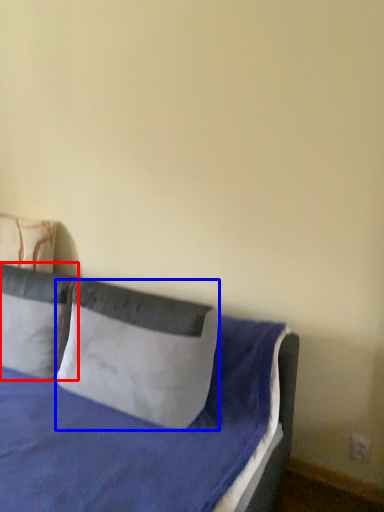
Question: Which object is closer to the camera taking this photo, pillow (highlighted by a red box) or pillow (highlighted by a blue box)?

Choices:
 (A) pillow
 (B) pillow

Answer: (B)